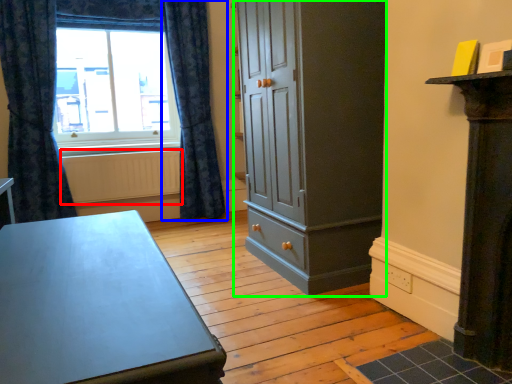
Question: Based on their relative distances, which object is farther from radiator (highlighted by a red box)? Choose from curtain (highlighted by a blue box) and cupboard (highlighted by a green box).

Choices:
 (A) curtain
 (B) cupboard

Answer: (B)